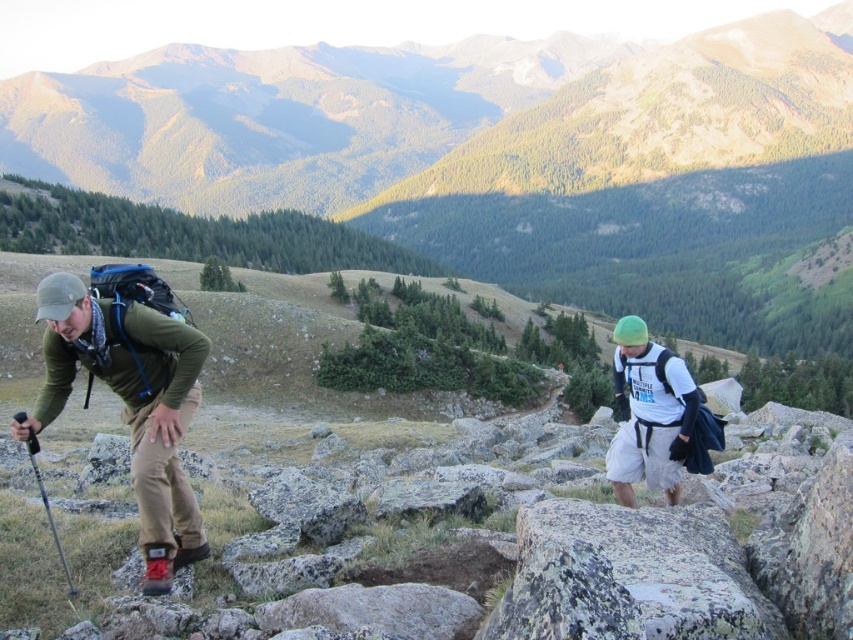
Measure the distance between green grassy mountain at upper center and white matte t-shirt at center-right.

A distance of 1948.32 feet exists between green grassy mountain at upper center and white matte t-shirt at center-right.

Is green grassy mountain at upper center smaller than white matte t-shirt at center-right?

No.

Is point (476, 36) positioned after point (614, 442)?

Yes.

Find the location of a particular element. The image size is (853, 640). green grassy mountain at upper center is located at coordinates (399, 109).

Who is more distant from viewer, (196, 96) or (57, 330)?

The point (196, 96) is more distant.

Can you confirm if green grassy mountain at upper center is thinner than matte green jacket at left?

In fact, green grassy mountain at upper center might be wider than matte green jacket at left.

The height and width of the screenshot is (640, 853). Find the location of `green grassy mountain at upper center`. green grassy mountain at upper center is located at coordinates (399, 109).

Who is higher up, matte green jacket at left or white matte t-shirt at center-right?

white matte t-shirt at center-right

Is point (164, 353) more distant than point (634, 435)?

No, it is not.

Locate an element on the screen. This screenshot has width=853, height=640. matte green jacket at left is located at coordinates (131, 403).